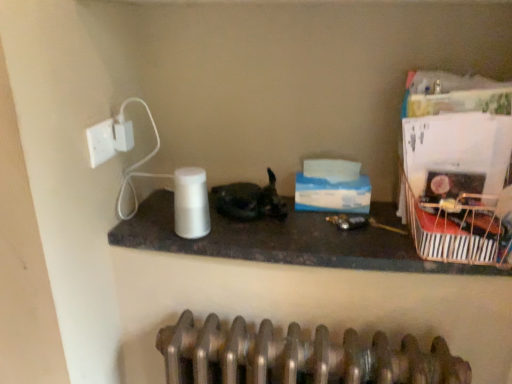
At what (x,y) coordinates should I click in order to perform the action: click on empty space that is ontop of white glossy speaker at center. Please return your answer as a coordinate pair (x, y). Image resolution: width=512 pixels, height=384 pixels. Looking at the image, I should click on (305, 212).